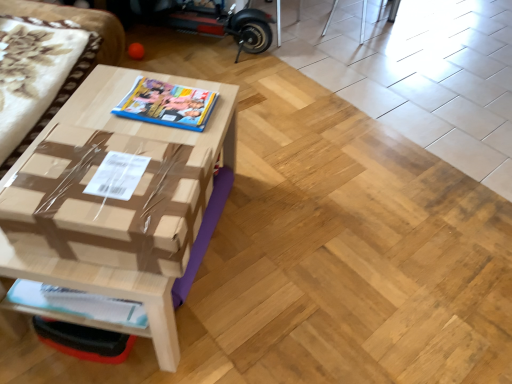
Find the location of `vacant space to the left of matte plastic magazine at center, placed as the 2th magazine when sorted from front to back`. vacant space to the left of matte plastic magazine at center, placed as the 2th magazine when sorted from front to back is located at coordinates (109, 92).